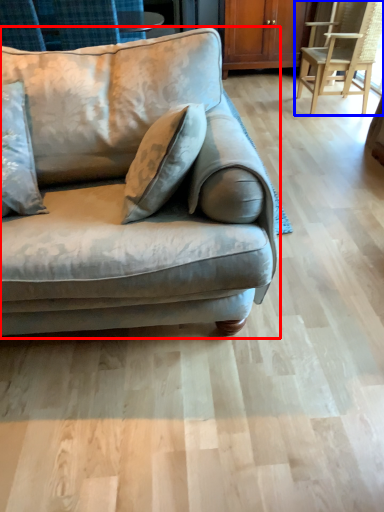
Question: Which point is closer to the camera, studio couch (highlighted by a red box) or chair (highlighted by a blue box)?

Choices:
 (A) studio couch
 (B) chair

Answer: (A)